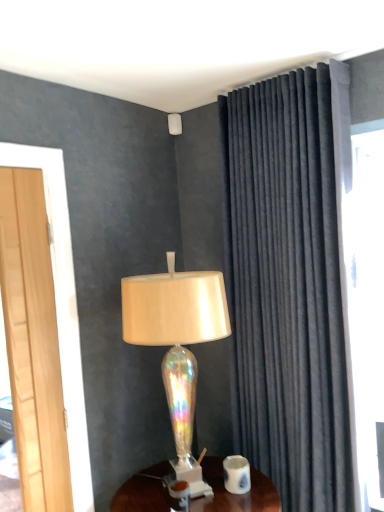
Question: From the image's perspective, is white glossy coffee cup at lower center on iridescent glass lampshade at upper center, the first lamp when ordered from back to front?

Choices:
 (A) no
 (B) yes

Answer: (A)

Question: Is the position of white glossy coffee cup at lower center less distant than that of iridescent glass lampshade at upper center, arranged as the 1th lamp when viewed from the top?

Choices:
 (A) yes
 (B) no

Answer: (A)

Question: Can you confirm if white glossy coffee cup at lower center is taller than iridescent glass lampshade at upper center, the first lamp when ordered from back to front?

Choices:
 (A) no
 (B) yes

Answer: (B)

Question: From a real-world perspective, is white glossy coffee cup at lower center physically above iridescent glass lampshade at upper center, marked as the 1th lamp in a left-to-right arrangement?

Choices:
 (A) yes
 (B) no

Answer: (B)

Question: Can you confirm if white glossy coffee cup at lower center is positioned to the right of iridescent glass lampshade at upper center, arranged as the second lamp when viewed from the front?

Choices:
 (A) yes
 (B) no

Answer: (A)

Question: From the image's perspective, is white glossy coffee cup at lower center beneath iridescent glass lampshade at upper center, marked as the 1th lamp in a left-to-right arrangement?

Choices:
 (A) yes
 (B) no

Answer: (A)

Question: Is iridescent glass lamp at center, the second lamp in the back-to-front sequence, facing towards iridescent glass lampshade at upper center, the 2th lamp in the right-to-left sequence?

Choices:
 (A) yes
 (B) no

Answer: (B)

Question: Is iridescent glass lamp at center, the 1th lamp when ordered from front to back, beside iridescent glass lampshade at upper center, marked as the 1th lamp in a left-to-right arrangement?

Choices:
 (A) no
 (B) yes

Answer: (A)

Question: Considering the relative sizes of iridescent glass lamp at center, the first lamp viewed from the right, and iridescent glass lampshade at upper center, arranged as the second lamp when viewed from the front, in the image provided, is iridescent glass lamp at center, the first lamp viewed from the right, thinner than iridescent glass lampshade at upper center, arranged as the second lamp when viewed from the front,?

Choices:
 (A) yes
 (B) no

Answer: (B)

Question: Is iridescent glass lampshade at upper center, arranged as the second lamp when viewed from the front, at the back of iridescent glass lamp at center, the second lamp in the back-to-front sequence?

Choices:
 (A) yes
 (B) no

Answer: (B)

Question: Is iridescent glass lamp at center, acting as the first lamp starting from the bottom, not close to iridescent glass lampshade at upper center, which is counted as the 2th lamp, starting from the bottom?

Choices:
 (A) no
 (B) yes

Answer: (A)

Question: Considering the relative positions of iridescent glass lamp at center, placed as the 2th lamp when sorted from top to bottom, and iridescent glass lampshade at upper center, the 2th lamp in the right-to-left sequence, in the image provided, is iridescent glass lamp at center, placed as the 2th lamp when sorted from top to bottom, to the left of iridescent glass lampshade at upper center, the 2th lamp in the right-to-left sequence, from the viewer's perspective?

Choices:
 (A) yes
 (B) no

Answer: (B)

Question: Can you confirm if velvet dark gray curtain at right is positioned to the right of white glossy coffee cup at lower center?

Choices:
 (A) yes
 (B) no

Answer: (A)